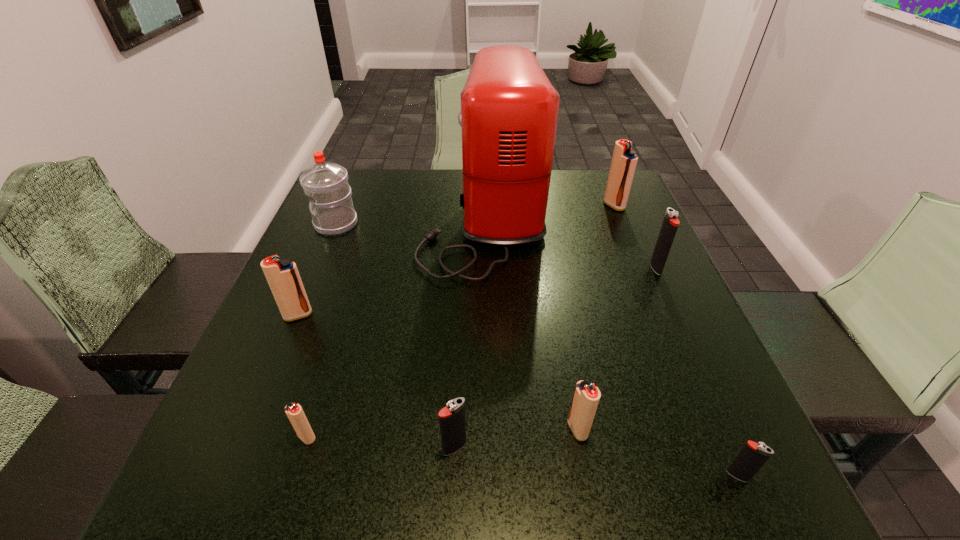
The height and width of the screenshot is (540, 960). What are the coordinates of `water bottle that is positioned at the left edge` in the screenshot? It's located at (326, 184).

At what (x,y) coordinates should I click in order to perform the action: click on object positioned at the far left corner. Please return your answer as a coordinate pair (x, y). The height and width of the screenshot is (540, 960). Looking at the image, I should click on (326, 184).

At what (x,y) coordinates should I click in order to perform the action: click on object situated at the far right corner. Please return your answer as a coordinate pair (x, y). The height and width of the screenshot is (540, 960). Looking at the image, I should click on (624, 161).

The width and height of the screenshot is (960, 540). What are the coordinates of `object positioned at the near right corner` in the screenshot? It's located at (752, 457).

Find the location of a particular element. The width and height of the screenshot is (960, 540). vacant position at the far edge of the desktop is located at coordinates (461, 211).

The image size is (960, 540). Identify the location of vacant space at the left edge of the desktop. (372, 224).

I want to click on free region at the right edge of the desktop, so click(x=623, y=258).

The width and height of the screenshot is (960, 540). In the image, there is a desktop. In order to click on vacant space at the far left corner in this screenshot , I will do `click(392, 168)`.

In the image, there is a desktop. Identify the location of vacant region at the near left corner. This screenshot has height=540, width=960. (269, 495).

At what (x,y) coordinates should I click in order to perform the action: click on vacant area at the far right corner. Please return your answer as a coordinate pair (x, y). This screenshot has height=540, width=960. Looking at the image, I should click on (586, 188).